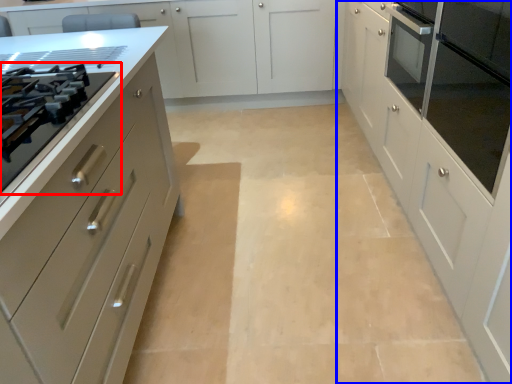
Question: Among these objects, which one is nearest to the camera, drawer (highlighted by a red box) or cabinetry (highlighted by a blue box)?

Choices:
 (A) drawer
 (B) cabinetry

Answer: (B)